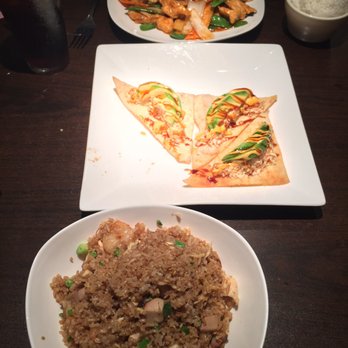
Locate an element on the screen. stain on plate is located at coordinates (97, 157).